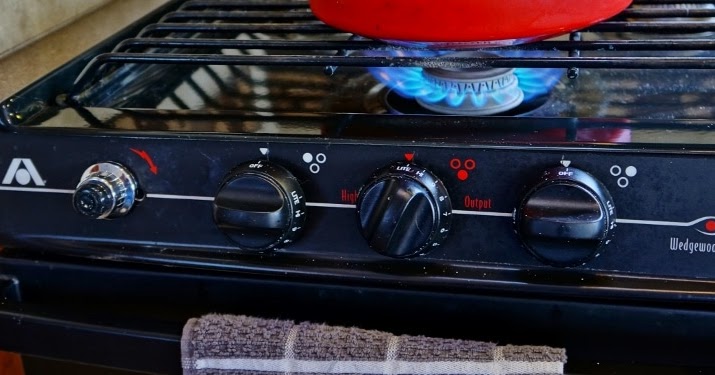
At what (x,y) coordinates should I click in order to perform the action: click on red metal pot. Please return your answer as a coordinate pair (x, y). Looking at the image, I should click on (465, 11).